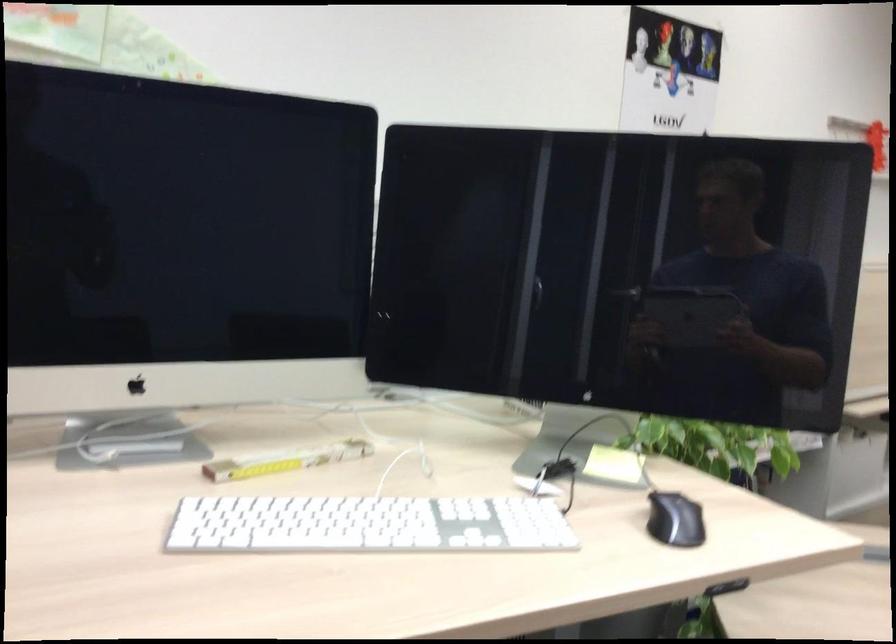
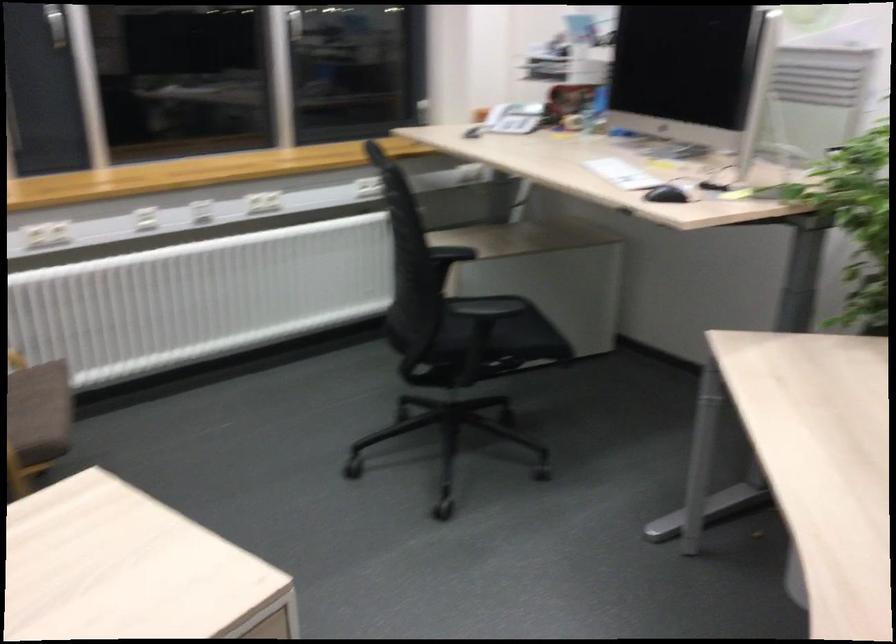
The point at (657, 529) is marked in the first image. Where is the corresponding point in the second image?

(666, 194)